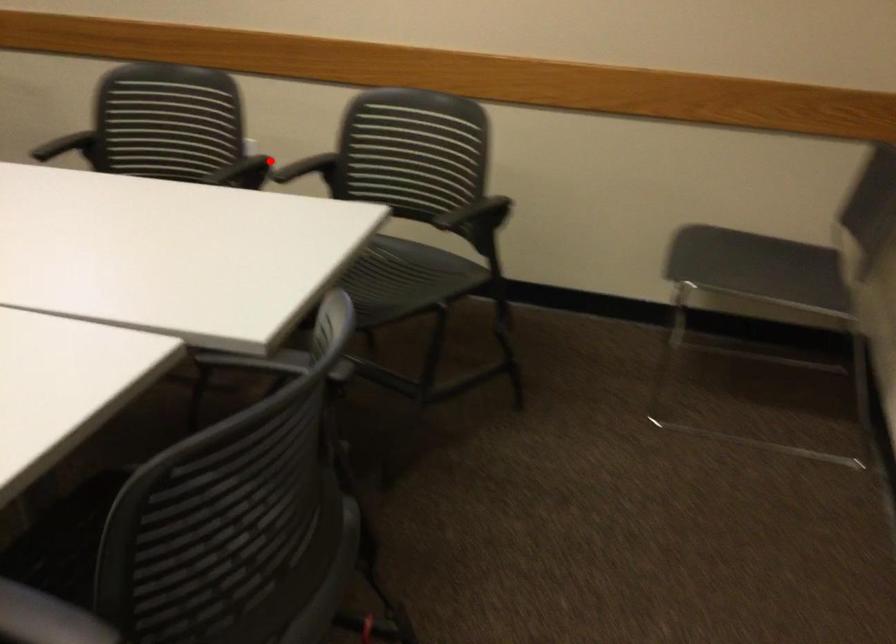
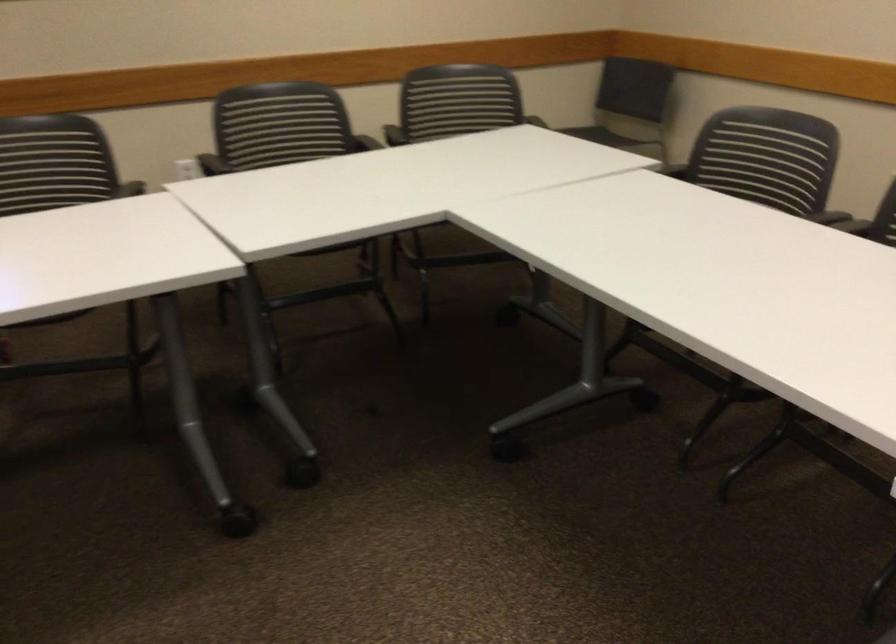
Question: I am providing you with two images of the same scene from different viewpoints. In image1, a red point is highlighted. Considering the same 3D point in image2, which of the following is correct?

Choices:
 (A) It is closer
 (B) It is farther

Answer: (B)